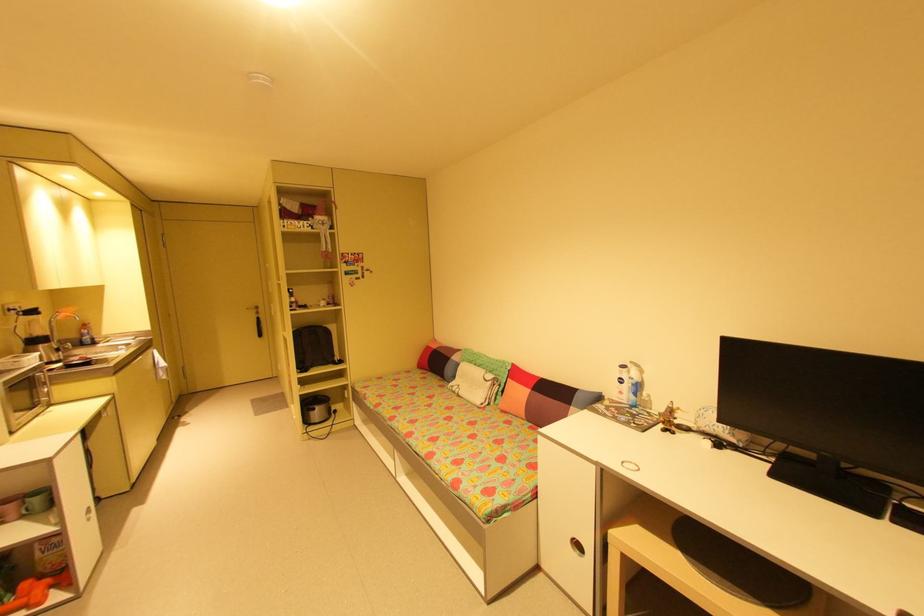
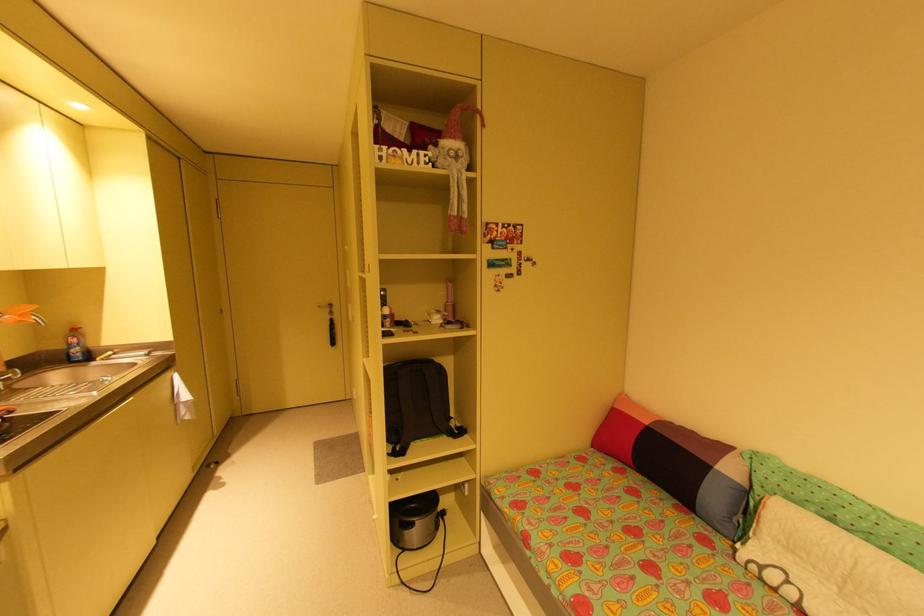
Find the pixel in the second image that matches (319,410) in the first image.

(417, 525)